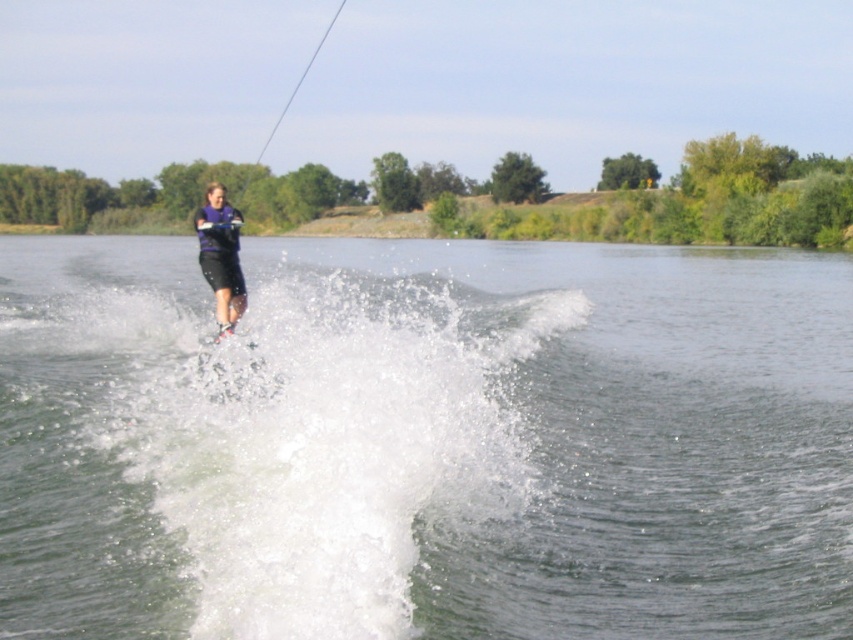
Based on the photo, does clear water at center have a greater height compared to purple matte shorts at center?

No, clear water at center is not taller than purple matte shorts at center.

Is clear water at center positioned at the back of purple matte shorts at center?

No, clear water at center is closer to the viewer.

Identify the location of clear water at center. (424, 442).

Find the location of a particular element. The height and width of the screenshot is (640, 853). clear water at center is located at coordinates (424, 442).